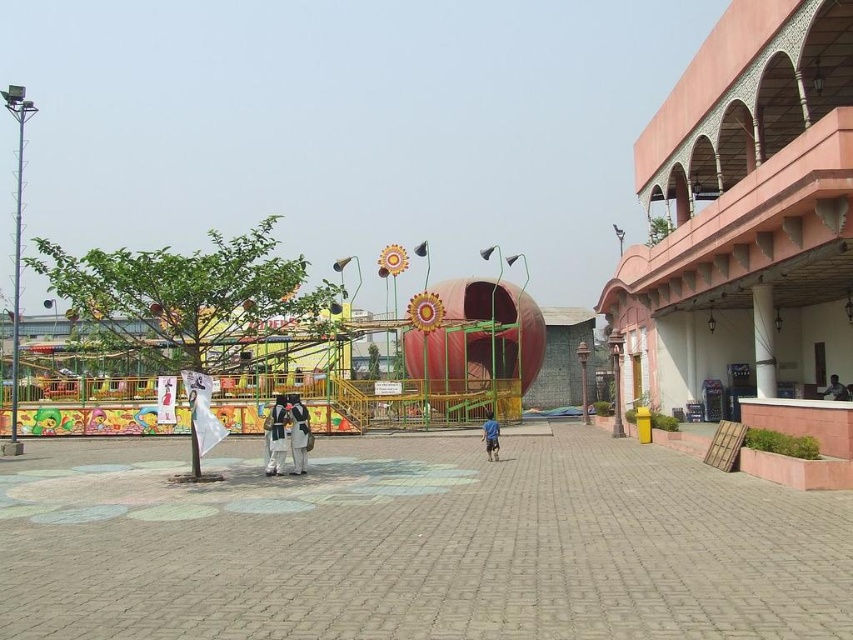
Can you confirm if smooth concrete pavement at center is wider than blue fabric person at center?

Correct, the width of smooth concrete pavement at center exceeds that of blue fabric person at center.

Does smooth concrete pavement at center appear under blue fabric person at center?

No.

Is point (724, 577) less distant than point (486, 422)?

Yes, point (724, 577) is closer to viewer.

Where is `smooth concrete pavement at center`? smooth concrete pavement at center is located at coordinates (421, 547).

Is metallic amusement park ride at center positioned at the back of dark blue fabric shirt at right?

No, it is in front of dark blue fabric shirt at right.

Which is in front, point (287, 381) or point (831, 374)?

Positioned in front is point (831, 374).

The height and width of the screenshot is (640, 853). Describe the element at coordinates (300, 328) in the screenshot. I see `metallic amusement park ride at center` at that location.

Where is `metallic amusement park ride at center`? The width and height of the screenshot is (853, 640). metallic amusement park ride at center is located at coordinates (300, 328).

Is metallic amusement park ride at center smaller than blue fabric person at center?

No.

Is metallic amusement park ride at center positioned before blue fabric person at center?

Yes, metallic amusement park ride at center is in front of blue fabric person at center.

Does point (219, 376) come farther from viewer compared to point (485, 429)?

Yes.

Find the location of `metallic amusement park ride at center`. metallic amusement park ride at center is located at coordinates (300, 328).